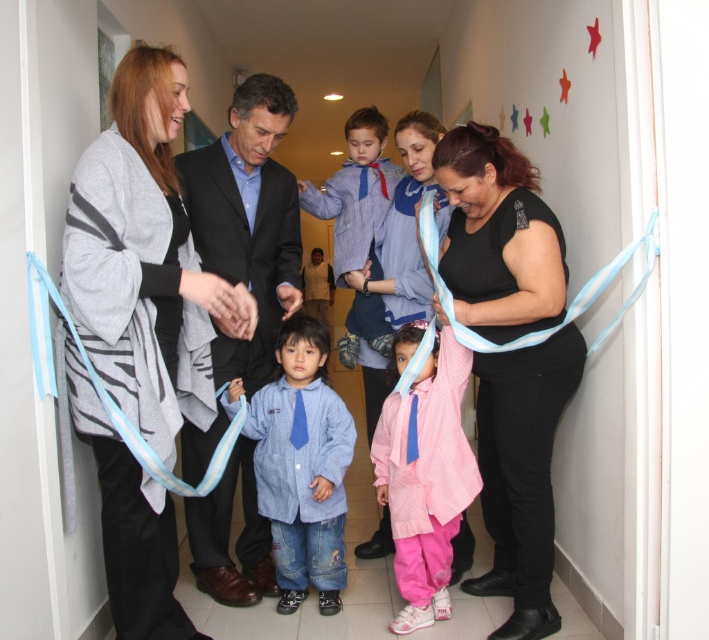
Question: Among these objects, which one is nearest to the camera?

Choices:
 (A) pink fabric dress at center
 (B) blue denim shirt at center
 (C) matte black shirt at center

Answer: (A)

Question: From the image, what is the correct spatial relationship of gray striped cardigan at left in relation to black matte shirt at center?

Choices:
 (A) left
 (B) right

Answer: (A)

Question: Based on their relative distances, which object is nearer to the matte black shirt at center?

Choices:
 (A) blue striped shirt at center
 (B) light blue silky ribbon at right

Answer: (A)

Question: Which object is the closest to the matte black shirt at center?

Choices:
 (A) blue striped shirt at center
 (B) blue satin ribbon at left
 (C) blue denim shirt at center

Answer: (A)

Question: Can you confirm if pink fabric dress at center is positioned to the left of light blue silky ribbon at right?

Choices:
 (A) yes
 (B) no

Answer: (A)

Question: Considering the relative positions of blue striped shirt at center and blue satin ribbon at left in the image provided, where is blue striped shirt at center located with respect to blue satin ribbon at left?

Choices:
 (A) right
 (B) left

Answer: (A)